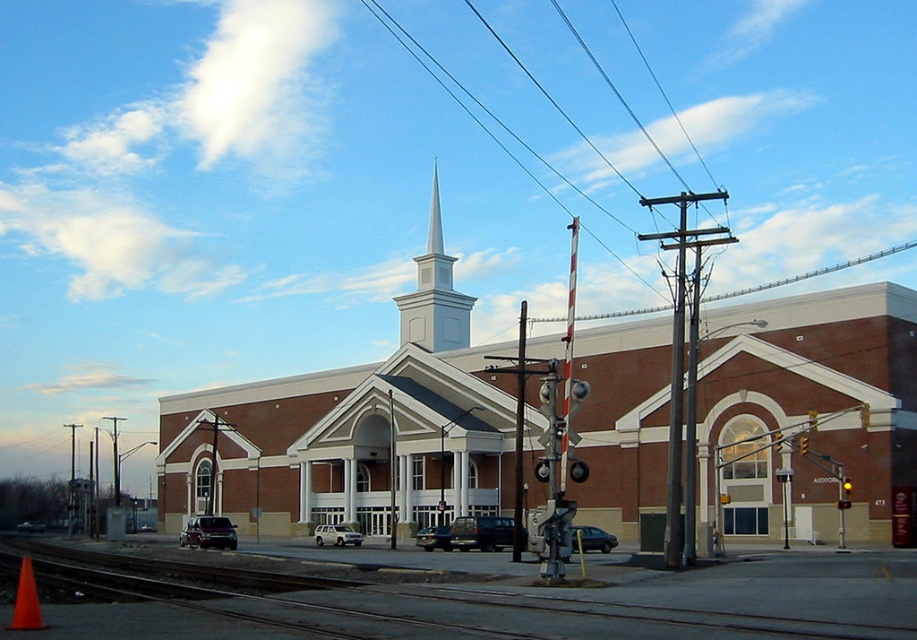
Measure the distance between point (418,284) and camera.

Point (418,284) is 82.97 meters away from camera.

Between white smooth steeple at center and yellow glass traffic light at upper right, which one is positioned lower?

yellow glass traffic light at upper right

Which is in front, point (432, 349) or point (842, 488)?

Point (842, 488)

Find the location of a particular element. white smooth steeple at center is located at coordinates pos(434,292).

Can you confirm if brick building at center is thinner than smooth asphalt train track at lower left?

In fact, brick building at center might be wider than smooth asphalt train track at lower left.

Is brick building at center behind smooth asphalt train track at lower left?

Yes.

Is point (446, 358) closer to viewer compared to point (543, 588)?

No.

You are a GUI agent. You are given a task and a screenshot of the screen. Output one action in this format:
    pyautogui.click(x=<x>, y=<y>)
    Task: Click on the brick building at center
    
    Given the screenshot: What is the action you would take?
    pyautogui.click(x=354, y=429)

Does orange plastic cone at lower left lie behind yellow glass traffic light at upper right?

No, it is in front of yellow glass traffic light at upper right.

The width and height of the screenshot is (917, 640). What do you see at coordinates (26, 600) in the screenshot?
I see `orange plastic cone at lower left` at bounding box center [26, 600].

Identify the location of orange plastic cone at lower left. (26, 600).